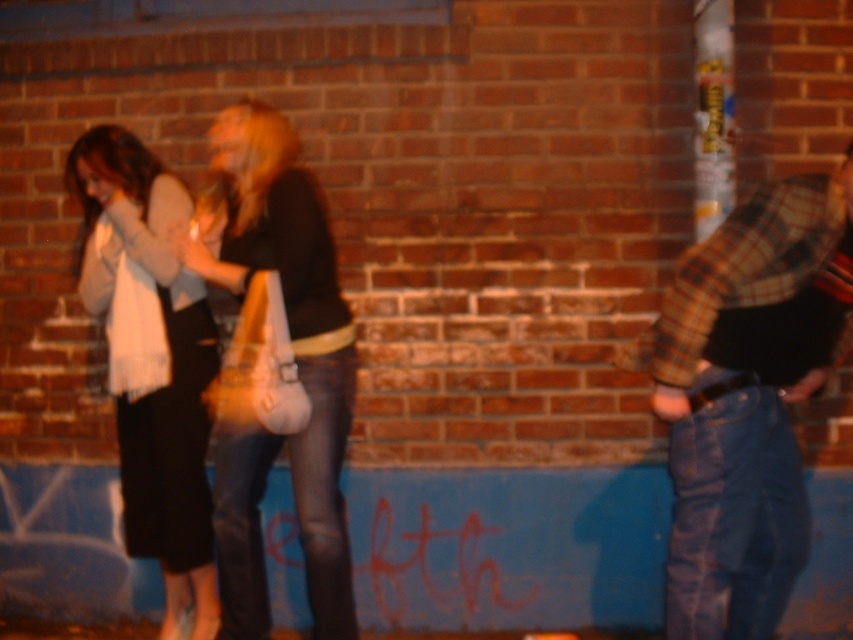
Question: Can you confirm if plaid flannel shirt at right is positioned below matte white bag at center?

Choices:
 (A) yes
 (B) no

Answer: (A)

Question: Does plaid flannel shirt at right appear on the right side of matte white bag at center?

Choices:
 (A) yes
 (B) no

Answer: (A)

Question: Among these objects, which one is nearest to the camera?

Choices:
 (A) white scarf at left
 (B) plaid flannel shirt at right

Answer: (B)

Question: Is matte white bag at center to the left of white scarf at left from the viewer's perspective?

Choices:
 (A) yes
 (B) no

Answer: (B)

Question: Which point is farther from the camera taking this photo?

Choices:
 (A) (318, 467)
 (B) (178, 340)

Answer: (B)

Question: Which of the following is the farthest from the observer?

Choices:
 (A) (712, 273)
 (B) (155, 480)
 (C) (335, 268)

Answer: (B)